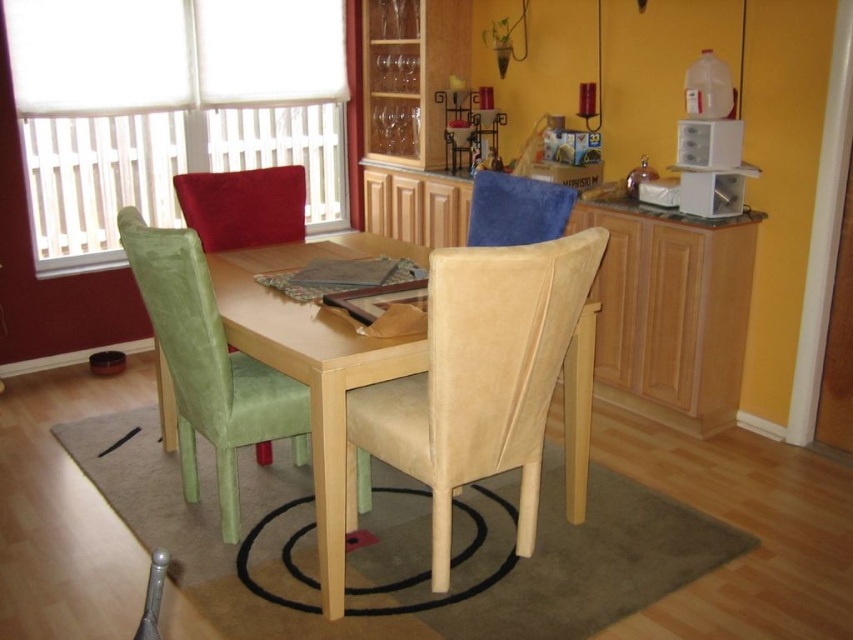
Question: Which object appears closest to the camera in this image?

Choices:
 (A) blue fabric chair at upper center
 (B) gray fabric at center
 (C) white matte window at upper left
 (D) green fabric chair at left

Answer: (D)

Question: Where is white matte window at upper left located in relation to blue fabric chair at upper center in the image?

Choices:
 (A) left
 (B) right

Answer: (A)

Question: Which object is closer to the camera taking this photo?

Choices:
 (A) white matte window at upper left
 (B) green fabric chair at left

Answer: (B)

Question: Which of the following is the farthest from the observer?

Choices:
 (A) white matte window at upper left
 (B) beige suede chair at center

Answer: (A)

Question: Is white matte window at upper left below blue fabric chair at upper center?

Choices:
 (A) no
 (B) yes

Answer: (A)

Question: Does white matte window at upper left have a lesser width compared to gray fabric at center?

Choices:
 (A) yes
 (B) no

Answer: (B)